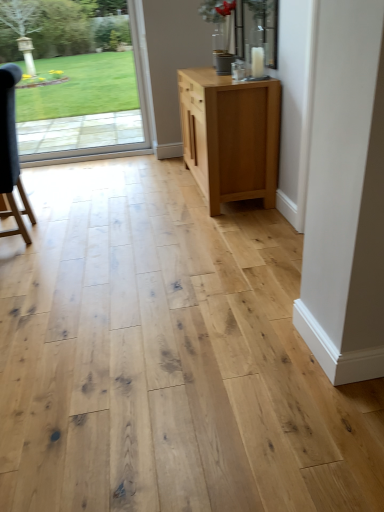
Question: Is transparent glass door at upper left in front of or behind natural wood cabinet at center in the image?

Choices:
 (A) behind
 (B) front

Answer: (A)

Question: From a real-world perspective, is transparent glass door at upper left above or below natural wood cabinet at center?

Choices:
 (A) above
 (B) below

Answer: (A)

Question: Which of these objects is positioned farthest from the natural wood cabinet at center?

Choices:
 (A) dark gray fabric chair at left
 (B) transparent glass door at upper left

Answer: (B)

Question: Estimate the real-world distances between objects in this image. Which object is farther from the transparent glass door at upper left?

Choices:
 (A) natural wood cabinet at center
 (B) dark gray fabric chair at left

Answer: (A)